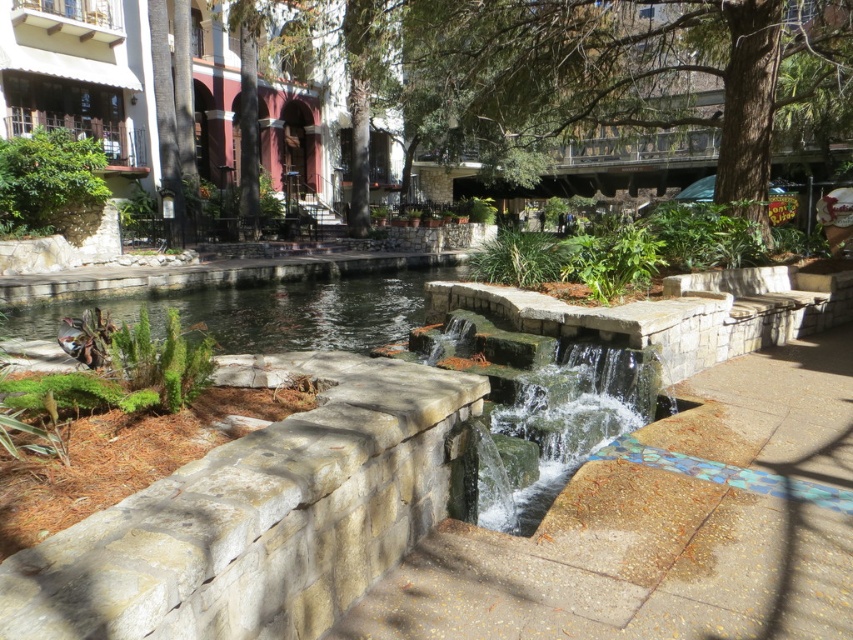
You are standing at the edge of the water feature in the urban park scene. You need to reach the smooth concrete steps at center. Which direction should you move to get there?

You should move towards the center of the scene to reach the smooth concrete steps at center.

You are standing at the entrance of the park and want to reach the smooth concrete steps at center. According to the map, the steps are marked at point (x=625, y=566). Can you confirm if the steps are indeed at that coordinate?

Yes, the smooth concrete steps at center is located at point (x=625, y=566) as per the Objects Description.